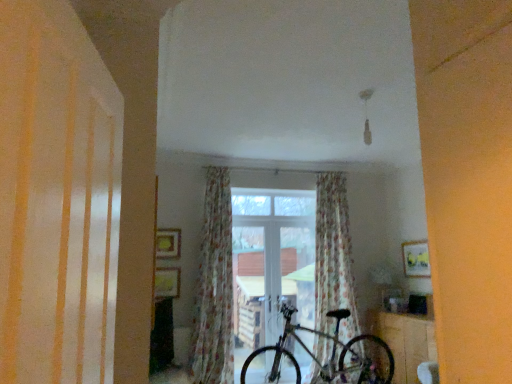
Question: Is white glossy shutter at left bigger or smaller than wooden table at lower right?

Choices:
 (A) big
 (B) small

Answer: (B)

Question: Do you think white glossy shutter at left is within wooden table at lower right, or outside of it?

Choices:
 (A) inside
 (B) outside

Answer: (B)

Question: Estimate the real-world distances between objects in this image. Which object is farther from the floral fabric curtain at center, acting as the second curtain starting from the left?

Choices:
 (A) wooden table at lower right
 (B) floral fabric curtain at center, which is the 2th curtain from right to left
 (C) shiny metallic bicycle at center
 (D) transparent glass window at center
 (E) white glossy shutter at left

Answer: (E)

Question: Which of these objects is positioned closest to the white glossy shutter at left?

Choices:
 (A) wooden table at lower right
 (B) floral fabric curtain at center, acting as the second curtain starting from the left
 (C) shiny metallic bicycle at center
 (D) transparent glass window at center
 (E) floral fabric curtain at center, which is the 2th curtain from right to left

Answer: (E)